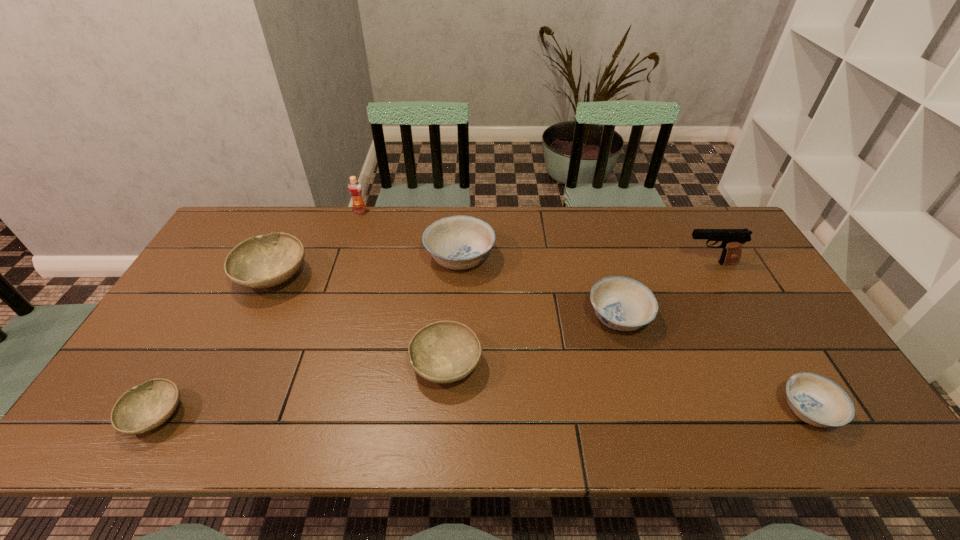
This screenshot has width=960, height=540. Find the location of `vacant space at the left edge`. vacant space at the left edge is located at coordinates (209, 266).

Identify the location of vacant space at the right edge. This screenshot has width=960, height=540. (727, 273).

You are a GUI agent. You are given a task and a screenshot of the screen. Output one action in this format:
    pyautogui.click(x=<x>, y=<y>)
    Task: Click on the free space at the far left corner of the desktop
    This screenshot has height=540, width=960.
    Given the screenshot: What is the action you would take?
    pyautogui.click(x=211, y=247)

The width and height of the screenshot is (960, 540). Find the location of `unoccupied position between the second blue bowl from left to right and the second smallest gray bowl`. unoccupied position between the second blue bowl from left to right and the second smallest gray bowl is located at coordinates (532, 341).

The height and width of the screenshot is (540, 960). What are the coordinates of `free space between the second biggest gray bowl and the farthest blue bowl` in the screenshot? It's located at point(453,311).

The width and height of the screenshot is (960, 540). Identify the location of unoccupied position between the leftmost blue bowl and the second farthest blue bowl. point(540,287).

Where is `empty space between the biggest gray bowl and the black pistol`? empty space between the biggest gray bowl and the black pistol is located at coordinates (491, 270).

Where is `free space between the leftmost blue bowl and the second biggest gray bowl`? This screenshot has height=540, width=960. free space between the leftmost blue bowl and the second biggest gray bowl is located at coordinates (453, 311).

Image resolution: width=960 pixels, height=540 pixels. I want to click on vacant space in between the farthest gray bowl and the rightmost blue bowl, so click(x=540, y=343).

In order to click on free spot between the rightmost gray bowl and the black pistol in this screenshot , I will do `click(578, 314)`.